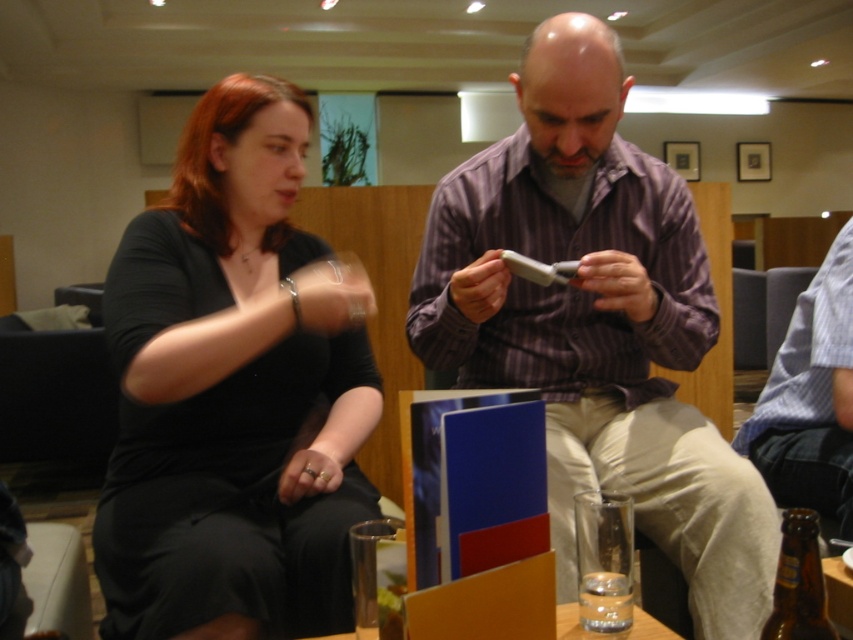
Measure the distance between black matte shirt at upper left and brown glass bottle at lower right.

black matte shirt at upper left is 29.68 inches from brown glass bottle at lower right.

Between point (183, 296) and point (782, 582), which one is positioned in front?

Positioned in front is point (782, 582).

Does point (329, 492) come closer to viewer compared to point (766, 636)?

No.

At what (x,y) coordinates should I click in order to perform the action: click on black matte shirt at upper left. Please return your answer as a coordinate pair (x, y). The height and width of the screenshot is (640, 853). Looking at the image, I should click on (233, 392).

In the scene shown: Is black matte shirt at upper left positioned before blue striped shirt at upper right?

Yes, black matte shirt at upper left is in front of blue striped shirt at upper right.

This screenshot has width=853, height=640. Describe the element at coordinates (233, 392) in the screenshot. I see `black matte shirt at upper left` at that location.

Locate an element on the screen. black matte shirt at upper left is located at coordinates [233, 392].

Which is in front, point (572, 40) or point (796, 609)?

Point (796, 609)

Is matte purple shirt at center behind brown glass bottle at lower right?

Yes, matte purple shirt at center is further from the viewer.

Is point (515, 86) behind point (782, 624)?

Yes.

Where is `matte purple shirt at center`? matte purple shirt at center is located at coordinates (596, 323).